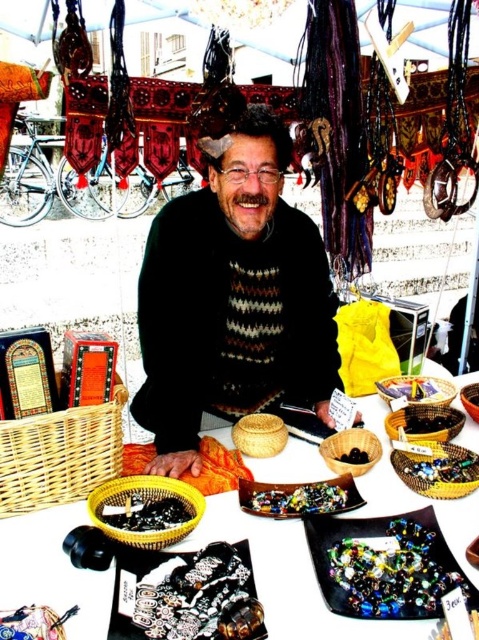
Which is more to the left, translucent glass beads at lower center or black glossy bowl at center?

Positioned to the left is black glossy bowl at center.

Does translucent glass beads at lower center have a smaller size compared to black glossy bowl at center?

No, translucent glass beads at lower center is not smaller than black glossy bowl at center.

Describe the element at coordinates (443, 468) in the screenshot. I see `translucent glass beads at lower center` at that location.

Where is `translucent glass beads at lower center`? The width and height of the screenshot is (479, 640). translucent glass beads at lower center is located at coordinates (443, 468).

Can you confirm if multicolored glass beads at center is taller than black glossy beads at lower left?

Result: Yes, multicolored glass beads at center is taller than black glossy beads at lower left.

Measure the distance between multicolored glass beads at center and black glossy beads at lower left.

52.59 centimeters

Does point (430, 509) come closer to viewer compared to point (173, 509)?

Yes, it is in front of point (173, 509).

Find the location of `multicolored glass beads at center`. multicolored glass beads at center is located at coordinates (390, 566).

Who is shorter, knitted sweater at center or silver metallic bracelet at center?

silver metallic bracelet at center

Which is behind, point (203, 276) or point (171, 602)?

The point (203, 276) is more distant.

Is point (322, 396) farther from viewer compared to point (193, 586)?

Yes, it is.

You are a GUI agent. You are given a task and a screenshot of the screen. Output one action in this format:
    pyautogui.click(x=<x>, y=<y>)
    Task: Click on the knitted sweater at center
    This screenshot has height=640, width=479.
    Given the screenshot: What is the action you would take?
    pyautogui.click(x=232, y=296)